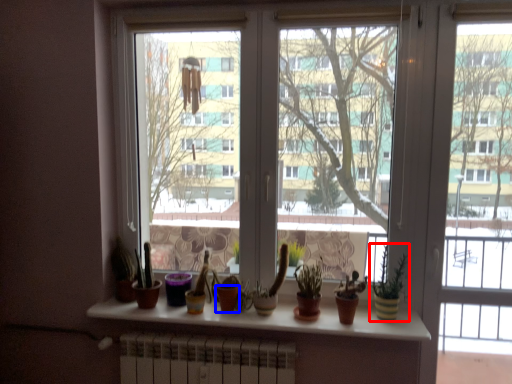
Question: Which point is further to the camera, houseplant (highlighted by a red box) or flowerpot (highlighted by a blue box)?

Choices:
 (A) houseplant
 (B) flowerpot

Answer: (B)